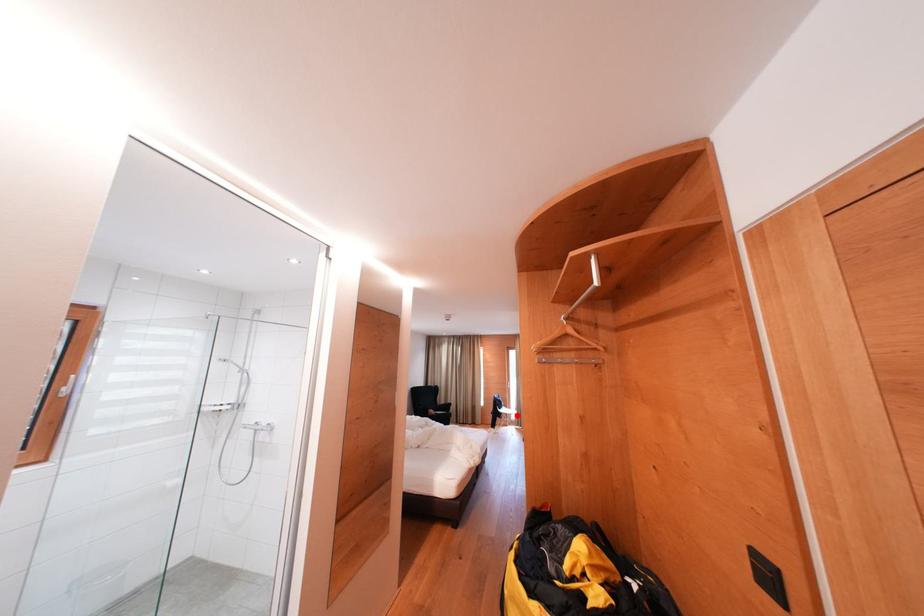
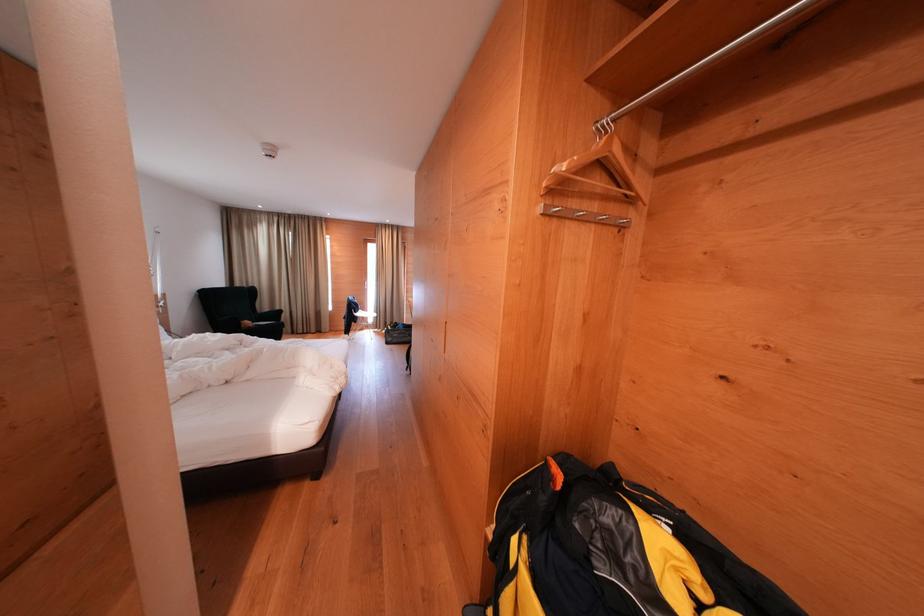
Where in the second image is the point corresponding to the highlighted location from the first image?

(374, 318)